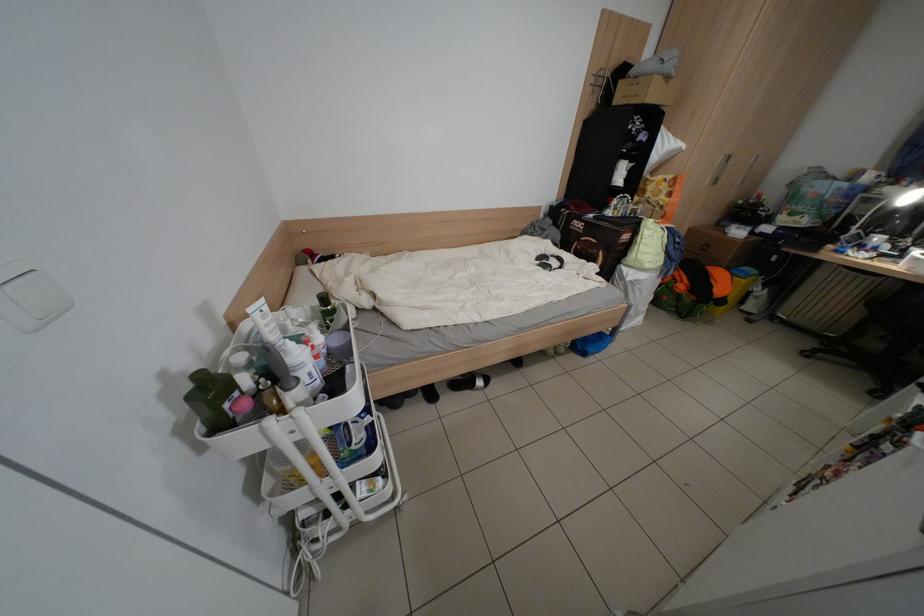
Where is `green bottle`? Image resolution: width=924 pixels, height=616 pixels. green bottle is located at coordinates (212, 399).